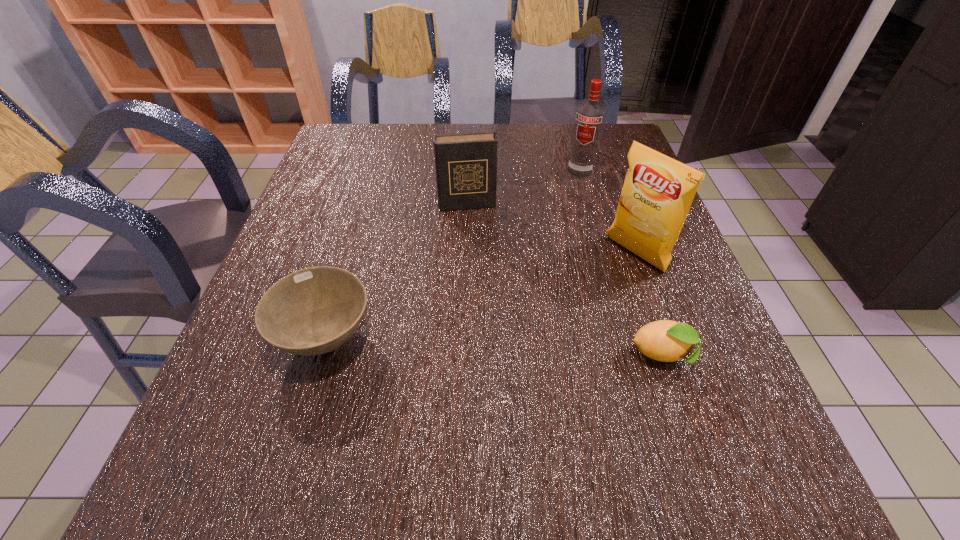
Identify which object is the closest to the bowl. Please provide its 2D coordinates. Your answer should be formatted as a tuple, i.e. [(x, y)], where the tuple contains the x and y coordinates of a point satisfying the conditions above.

[(466, 164)]

Locate which object is the closest to the bowl. Please provide its 2D coordinates. Your answer should be formatted as a tuple, i.e. [(x, y)], where the tuple contains the x and y coordinates of a point satisfying the conditions above.

[(466, 164)]

The height and width of the screenshot is (540, 960). Find the location of `vacant space that satisfies the following two spatial constraints: 1. on the front side of the farthest object; 2. on the left side of the crisp (potato chip)`. vacant space that satisfies the following two spatial constraints: 1. on the front side of the farthest object; 2. on the left side of the crisp (potato chip) is located at coordinates (604, 254).